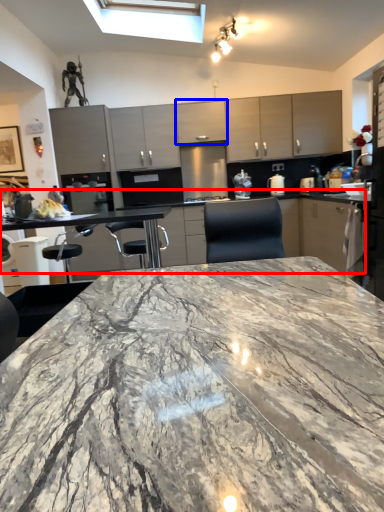
Question: Which of the following is the closest to the observer, counter top (highlighted by a red box) or cabinetry (highlighted by a blue box)?

Choices:
 (A) counter top
 (B) cabinetry

Answer: (A)